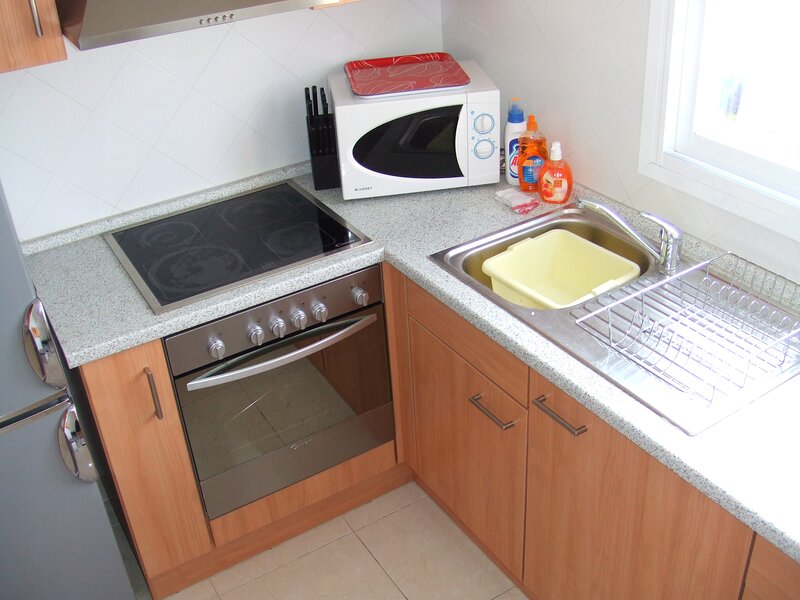
The width and height of the screenshot is (800, 600). Identify the location of oven knob 6. (362, 297).